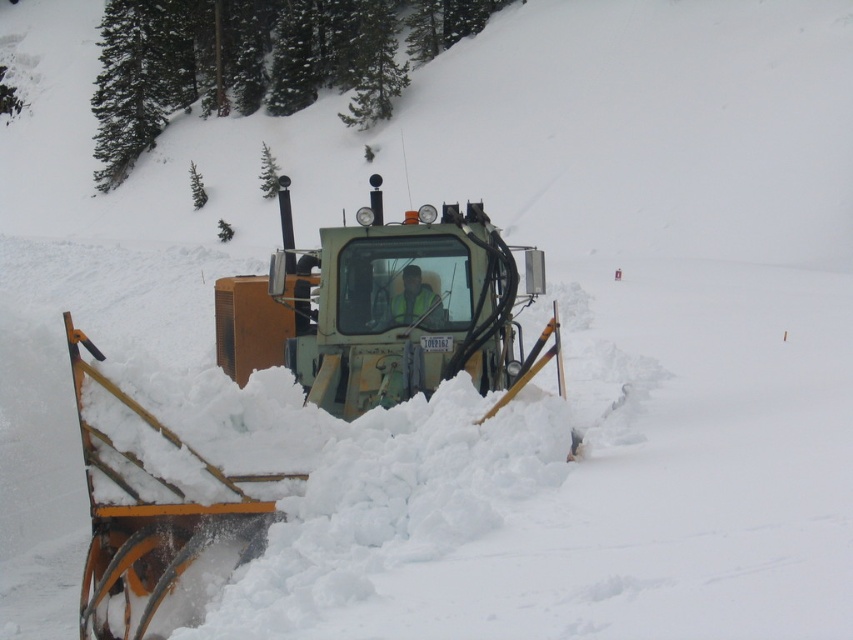
You are standing at point 0.5, 0.5 in the image. You need to locate the green matte snowplow at center. Is it to your north, south, east, or west?

The green matte snowplow at center is located at point (378, 308). Since you are at point (426, 320), it is slightly southwest of your position because the x and y coordinates are both slightly lower than yours.

You are a safety inspector checking the visibility of the reflective yellow vest at center from the cabin of the green matte snowplow at center. Based on their positions, can the operator see the vest clearly from inside the cabin?

The green matte snowplow at center is positioned over the reflective yellow vest at center, meaning the vest is underneath the snowplow. Since the snowplow is large and the vest is below it, the operator inside the cabin likely cannot see the vest clearly due to the vehicle obstructing the view.